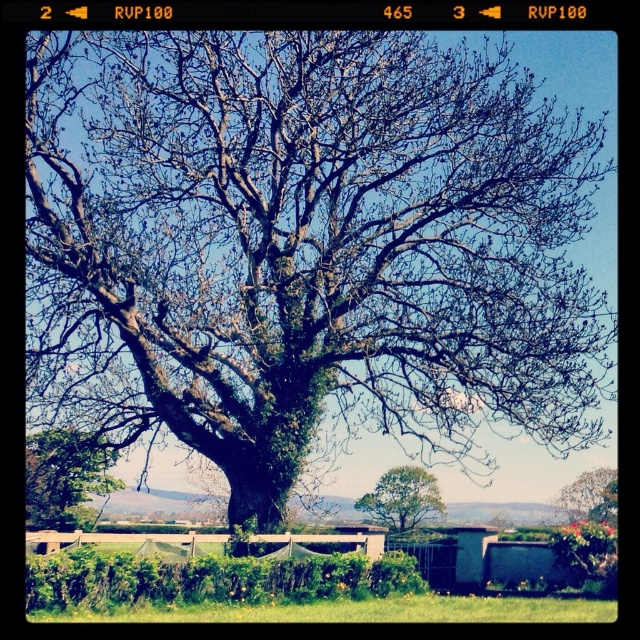
Can you confirm if green grass at lower center is positioned below green mossy tree at center?

Yes.

Which is more to the left, green grass at lower center or green mossy tree at center?

green grass at lower center

Image resolution: width=640 pixels, height=640 pixels. Find the location of `green grass at lower center`. green grass at lower center is located at coordinates coord(362,611).

This screenshot has width=640, height=640. What are the coordinates of `green grass at lower center` in the screenshot? It's located at (362, 611).

Is green leafy tree at center behind green mossy tree at center?

Yes, it is.

Between green leafy tree at center and green mossy tree at center, which one has less height?

Standing shorter between the two is green mossy tree at center.

The height and width of the screenshot is (640, 640). What do you see at coordinates (403, 499) in the screenshot?
I see `green leafy tree at center` at bounding box center [403, 499].

Find the location of a particular element. green leafy tree at center is located at coordinates (403, 499).

Where is `green grass at lower center`? This screenshot has width=640, height=640. green grass at lower center is located at coordinates (362, 611).

Who is shorter, green grass at lower center or green leafy tree at lower left?

green grass at lower center is shorter.

Is point (520, 612) farther from viewer compared to point (52, 474)?

No.

Where is `green grass at lower center`? The image size is (640, 640). green grass at lower center is located at coordinates (362, 611).